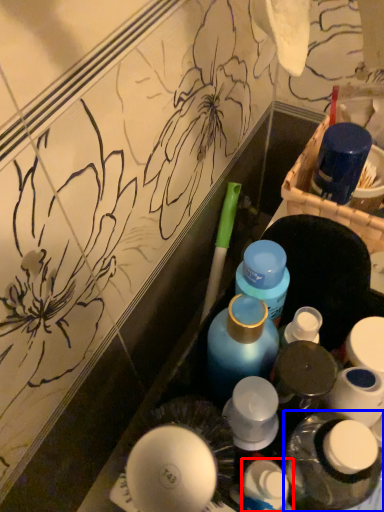
Question: Which point is closer to the camera, toiletry (highlighted by a red box) or bottle (highlighted by a blue box)?

Choices:
 (A) toiletry
 (B) bottle

Answer: (B)